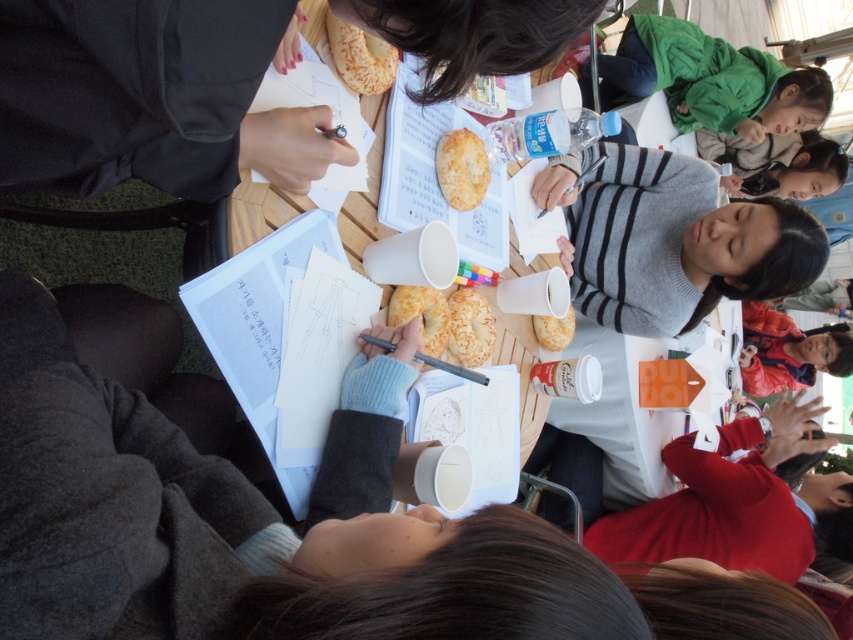
Consider the image. Can you confirm if golden crispy bread at center is smaller than golden crumbly pastry at center?

Indeed, golden crispy bread at center has a smaller size compared to golden crumbly pastry at center.

Does point (450, 160) lie in front of point (474, 291)?

Yes, point (450, 160) is closer to viewer.

The image size is (853, 640). I want to click on golden crispy bread at center, so click(461, 168).

Who is lower down, wooden table at center or green fuzzy jacket at upper right?

wooden table at center

Can you confirm if wooden table at center is smaller than green fuzzy jacket at upper right?

Indeed, wooden table at center has a smaller size compared to green fuzzy jacket at upper right.

Image resolution: width=853 pixels, height=640 pixels. I want to click on wooden table at center, so click(473, 33).

Does wooden table at center have a larger size compared to golden brown bread at center?

Yes.

Which is above, wooden table at center or golden brown bread at center?

wooden table at center

Where is `wooden table at center`? The width and height of the screenshot is (853, 640). wooden table at center is located at coordinates (473, 33).